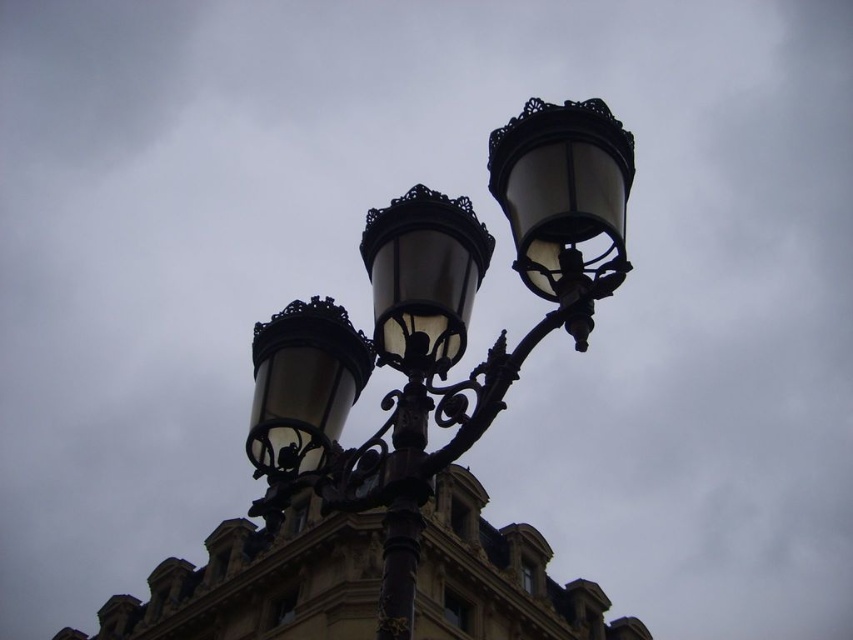
Can you confirm if matte black lamp at upper right is taller than black wrought iron pole at center?

Yes.

Between point (543, 243) and point (383, 563), which one is positioned in front?

Point (543, 243) is in front.

The width and height of the screenshot is (853, 640). Find the location of `matte black lamp at upper right`. matte black lamp at upper right is located at coordinates click(563, 195).

Can you confirm if matte black street light at center is positioned to the left of matte black lamp at upper right?

Indeed, matte black street light at center is positioned on the left side of matte black lamp at upper right.

Where is `matte black street light at center`? The width and height of the screenshot is (853, 640). matte black street light at center is located at coordinates (436, 328).

The image size is (853, 640). I want to click on matte black street light at center, so click(436, 328).

Describe the element at coordinates (436, 328) in the screenshot. I see `matte black street light at center` at that location.

Based on the photo, who is taller, matte black street light at center or black wrought iron pole at center?

matte black street light at center is taller.

What do you see at coordinates (436, 328) in the screenshot? This screenshot has width=853, height=640. I see `matte black street light at center` at bounding box center [436, 328].

Find the location of a particular element. The width and height of the screenshot is (853, 640). matte black street light at center is located at coordinates (436, 328).